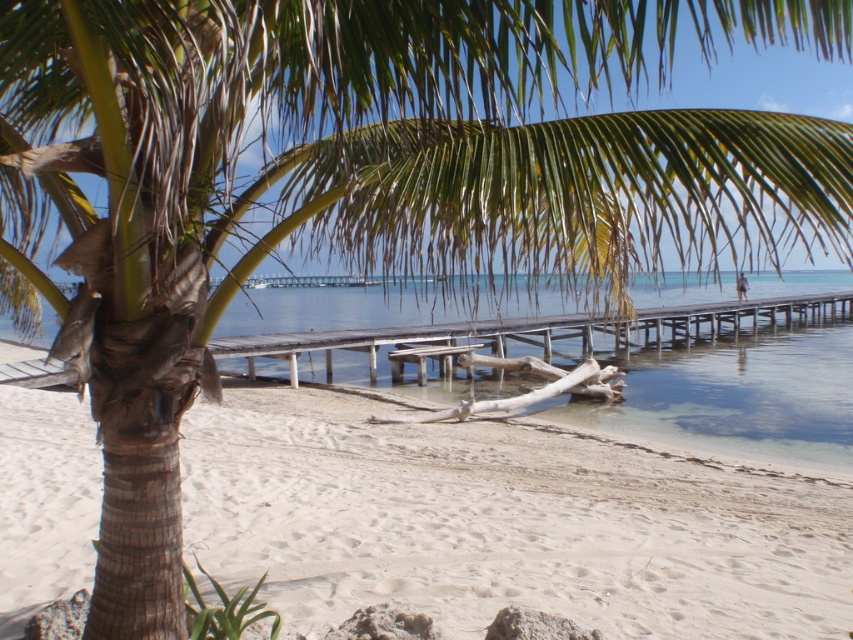
Is white sandy beach at lower left wider than clear blue water at center?

Incorrect, white sandy beach at lower left's width does not surpass clear blue water at center's.

Can you confirm if white sandy beach at lower left is thinner than clear blue water at center?

Correct, white sandy beach at lower left's width is less than clear blue water at center's.

Where is `white sandy beach at lower left`? white sandy beach at lower left is located at coordinates (503, 522).